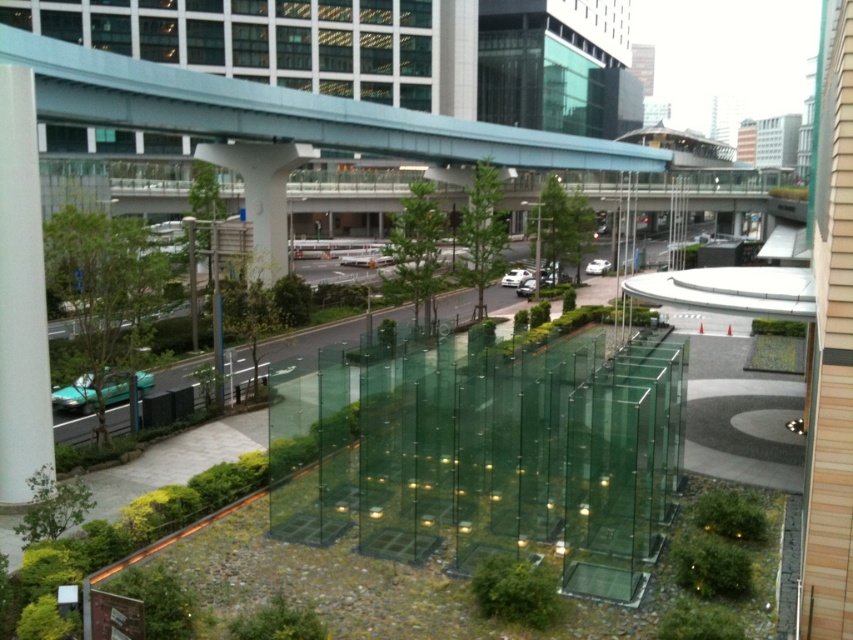
Question: Does transparent glass window at upper center have a smaller size compared to white smooth pillar at left?

Choices:
 (A) no
 (B) yes

Answer: (A)

Question: Which of the following is the farthest from the observer?

Choices:
 (A) (431, 13)
 (B) (33, 413)

Answer: (A)

Question: Is transparent glass window at upper center wider than white smooth pillar at left?

Choices:
 (A) no
 (B) yes

Answer: (B)

Question: Which of the following is the closest to the observer?

Choices:
 (A) (186, 10)
 (B) (15, 401)

Answer: (B)

Question: Which of the following is the farthest from the observer?

Choices:
 (A) (50, 433)
 (B) (148, 6)

Answer: (B)

Question: Can you confirm if transparent glass window at upper center is smaller than white smooth pillar at left?

Choices:
 (A) yes
 (B) no

Answer: (B)